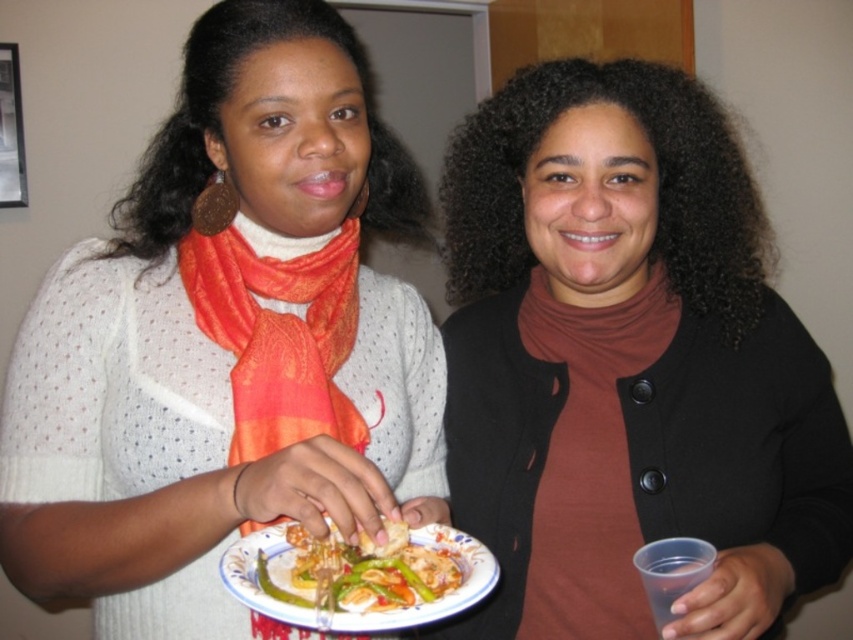
Does point (469, 208) lie behind point (416, 600)?

That is True.

Between brown matte sweater at center and shiny plastic fork at lower center, which one has less height?

With less height is shiny plastic fork at lower center.

At what (x,y) coordinates should I click in order to perform the action: click on brown matte sweater at center. Please return your answer as a coordinate pair (x, y). The height and width of the screenshot is (640, 853). Looking at the image, I should click on (625, 355).

Can you confirm if orange silk scarf at left is positioned to the right of shiny plastic fork at lower center?

No, orange silk scarf at left is not to the right of shiny plastic fork at lower center.

Which is in front, point (317, 412) or point (302, 605)?

Point (302, 605)

Find the location of `orange silk scarf at left`. orange silk scarf at left is located at coordinates (276, 326).

Which is behind, point (184, 404) or point (282, 371)?

The point (282, 371) is behind.

This screenshot has width=853, height=640. Identify the location of matte orange scarf at center. tap(223, 342).